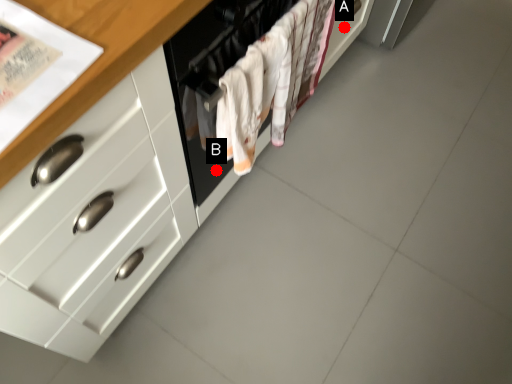
Question: Two points are circled on the image, labeled by A and B beside each circle. Which of the following is the farthest from the observer?

Choices:
 (A) A is further
 (B) B is further

Answer: (A)